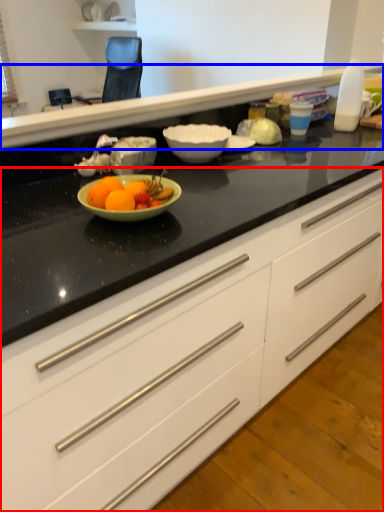
Question: Which object is further to the camera taking this photo, cabinetry (highlighted by a red box) or counter top (highlighted by a blue box)?

Choices:
 (A) cabinetry
 (B) counter top

Answer: (B)